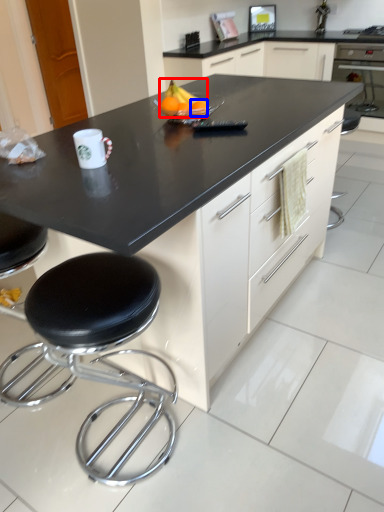
Question: Which point is closer to the camera, fruit (highlighted by a red box) or orange (highlighted by a blue box)?

Choices:
 (A) fruit
 (B) orange

Answer: (B)